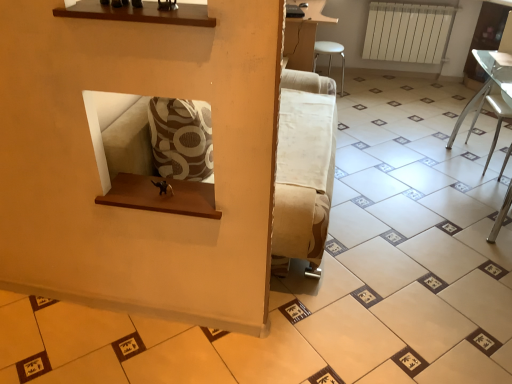
The height and width of the screenshot is (384, 512). Identify the location of free space that is to the left of clear glass table at right, acting as the 2th furniture starting from the left. (401, 215).